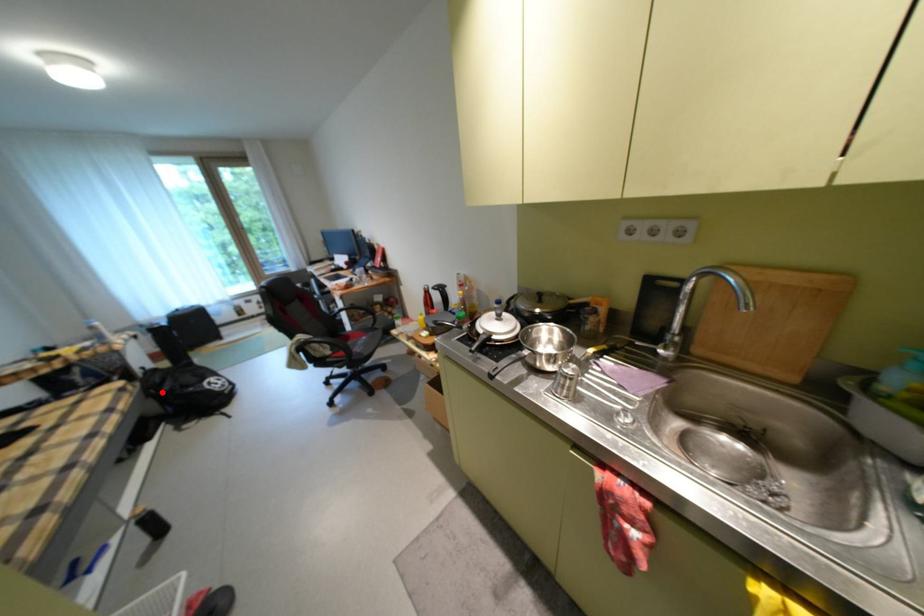
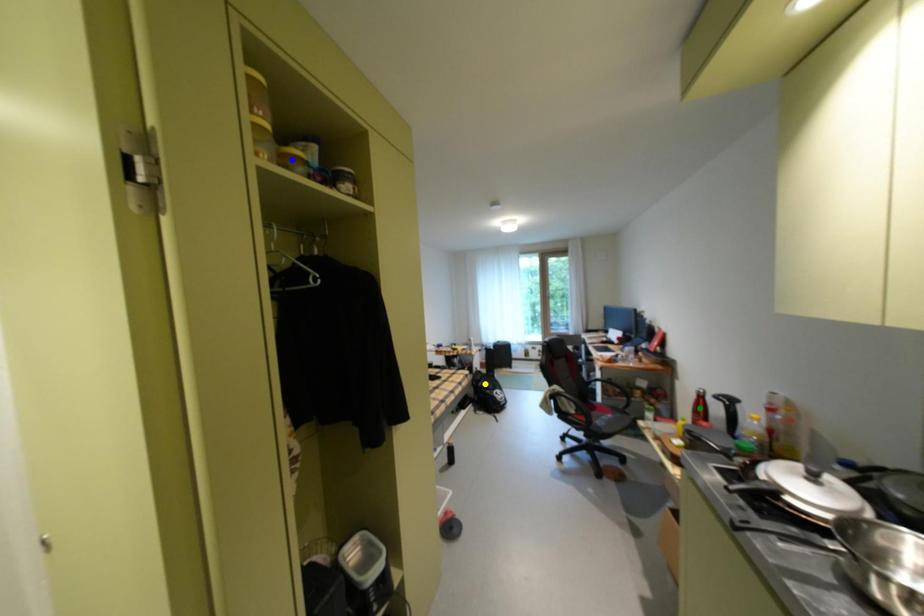
Question: I am providing you with two images of the same scene from different viewpoints. A red point is marked on the first image. You are given multiple points on the second image. In image 2, which mark is for the same physical point as the one in image 1?

Choices:
 (A) green point
 (B) blue point
 (C) yellow point

Answer: (C)